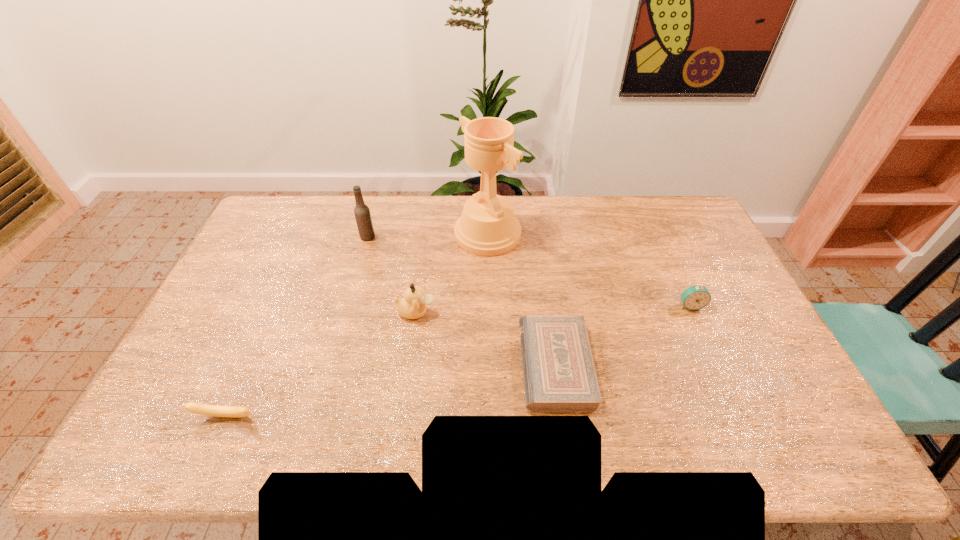
At what (x,y) coordinates should I click in order to perform the action: click on object present at the right edge. Please return your answer as a coordinate pair (x, y). Looking at the image, I should click on (696, 297).

In the image, there is a desktop. Identify the location of vacant area at the far edge. This screenshot has height=540, width=960. (561, 203).

In the image, there is a desktop. At what (x,y) coordinates should I click in order to perform the action: click on vacant space at the near edge. Please return your answer as a coordinate pair (x, y). The width and height of the screenshot is (960, 540). Looking at the image, I should click on (583, 432).

Image resolution: width=960 pixels, height=540 pixels. In the image, there is a desktop. What are the coordinates of `free region at the left edge` in the screenshot? It's located at (229, 275).

Where is `vacant point at the right edge`? vacant point at the right edge is located at coordinates (733, 347).

At what (x,y) coordinates should I click in order to perform the action: click on free spot between the tallest object and the fifth tallest object. Please return your answer as a coordinate pair (x, y). This screenshot has height=540, width=960. Looking at the image, I should click on (357, 325).

Find the location of a particular element. vacant area that lies between the award and the banana is located at coordinates (357, 325).

Locate an element on the screen. This screenshot has width=960, height=540. vacant area that lies between the Bible and the second object from left to right is located at coordinates point(462,301).

Image resolution: width=960 pixels, height=540 pixels. In order to click on vacant area that lies between the rightmost object and the fourth shortest object in this screenshot , I will do `click(553, 309)`.

This screenshot has width=960, height=540. I want to click on vacant area between the fourth shortest object and the tallest object, so click(x=452, y=273).